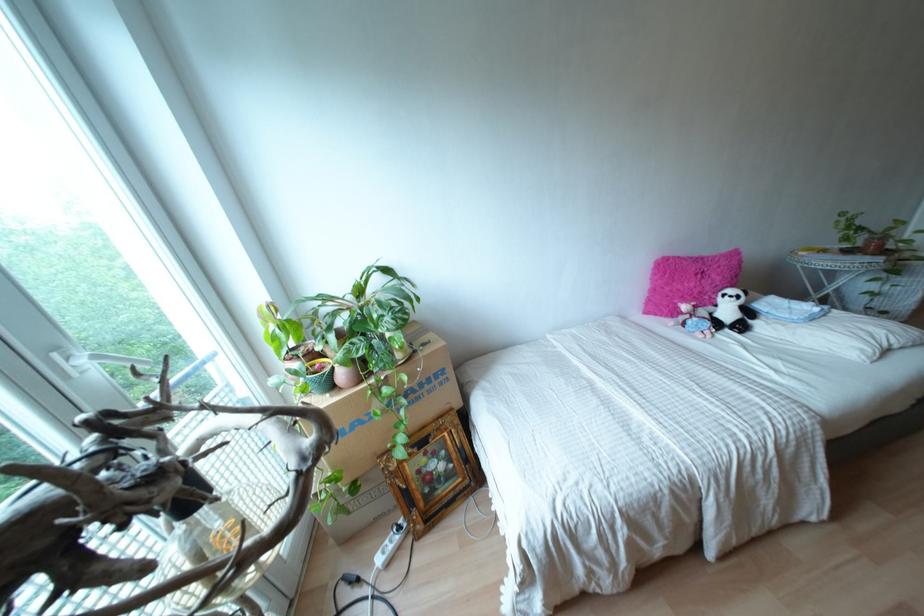
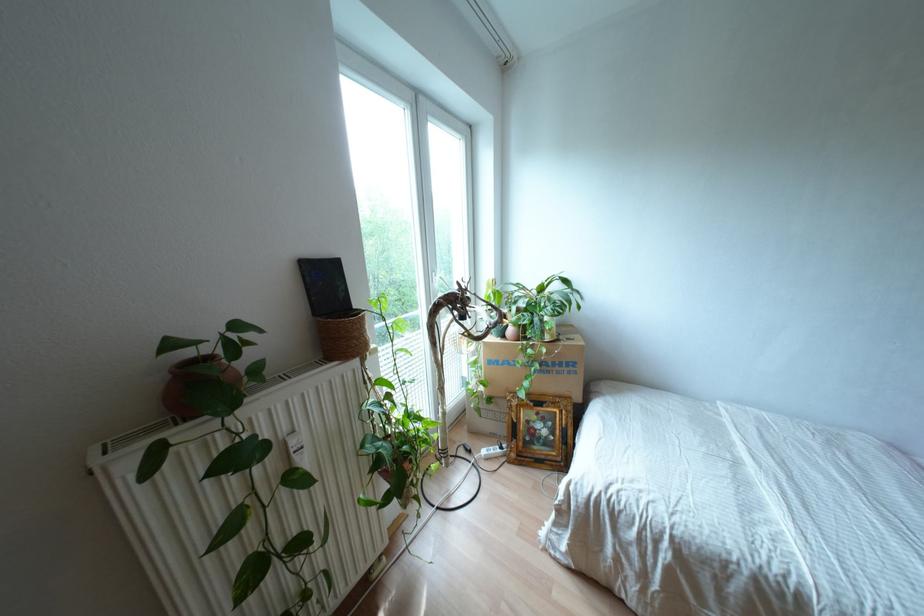
Find the pixel in the second image that matches (423,469) in the first image.

(530, 424)